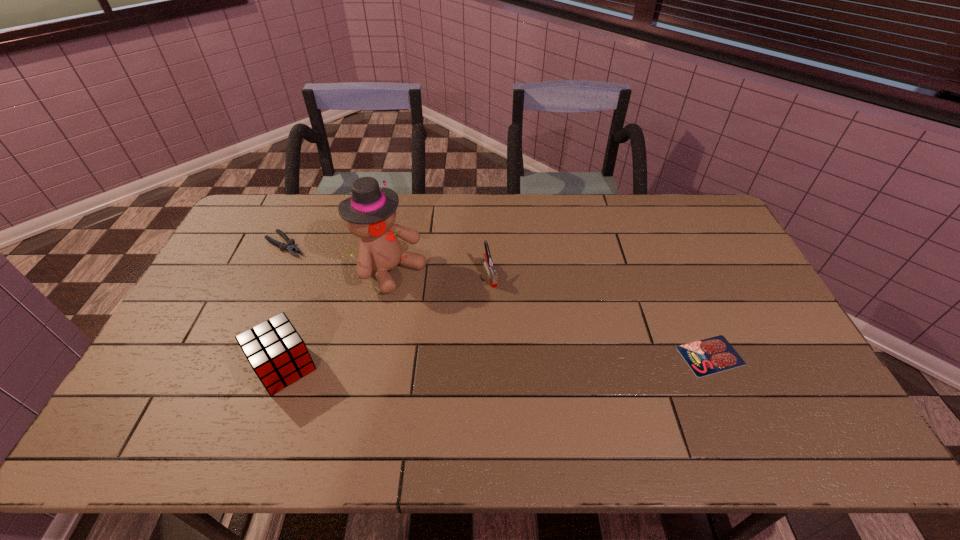
Identify which object is located as the fourth nearest to the second shortest object. Please provide its 2D coordinates. Your answer should be formatted as a tuple, i.e. [(x, y)], where the tuple contains the x and y coordinates of a point satisfying the conditions above.

[(712, 355)]

Find the location of `object that is the third closest to the tallest object`. object that is the third closest to the tallest object is located at coordinates (290, 247).

The width and height of the screenshot is (960, 540). Identify the location of vacant space that satisfies the following two spatial constraints: 1. on the front side of the third shortest object; 2. on the right side of the pliers. pos(273,273).

Find the location of `vacant point that satisfies the following two spatial constraints: 1. on the front side of the cube; 2. on the left side of the pliers`. vacant point that satisfies the following two spatial constraints: 1. on the front side of the cube; 2. on the left side of the pliers is located at coordinates (229, 367).

The width and height of the screenshot is (960, 540). What are the coordinates of `free location that satisfies the following two spatial constraints: 1. on the front side of the pliers; 2. on the left side of the second tallest object` in the screenshot? It's located at (229, 367).

What are the coordinates of `free space that satisfies the following two spatial constraints: 1. on the back side of the tallest object; 2. on the left side of the fourth shortest object` in the screenshot? It's located at [319, 271].

I want to click on vacant area in the image that satisfies the following two spatial constraints: 1. on the back side of the salami; 2. on the left side of the fourth shortest object, so click(289, 355).